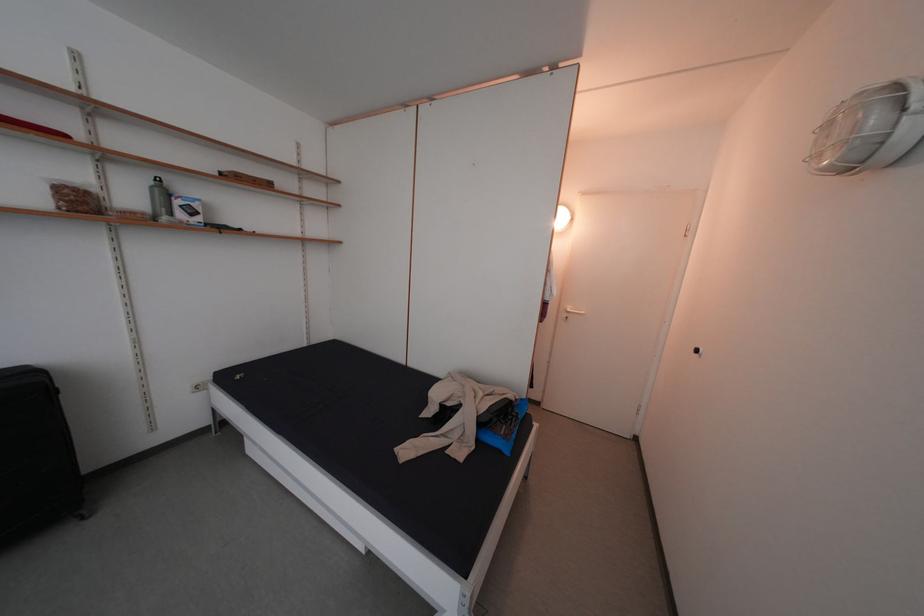
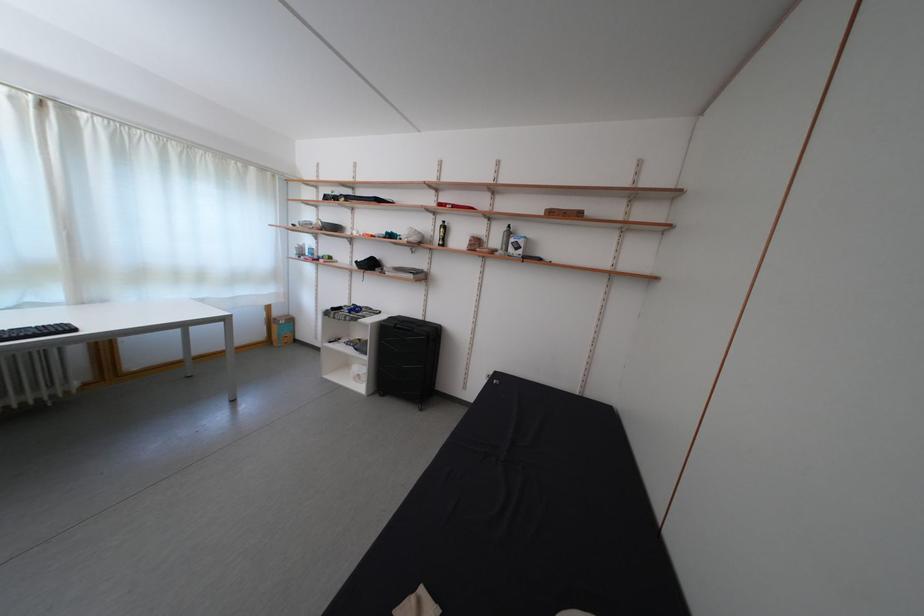
Question: The first image is from the beginning of the video and the second image is from the end. How did the camera likely rotate when shooting the video?

Choices:
 (A) Left
 (B) Right
 (C) Up
 (D) Down

Answer: (A)